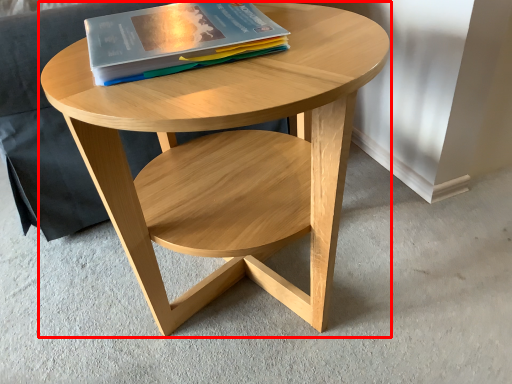
Question: From the image's perspective, where is coffee table (annotated by the red box) located in relation to book in the image?

Choices:
 (A) below
 (B) above

Answer: (A)